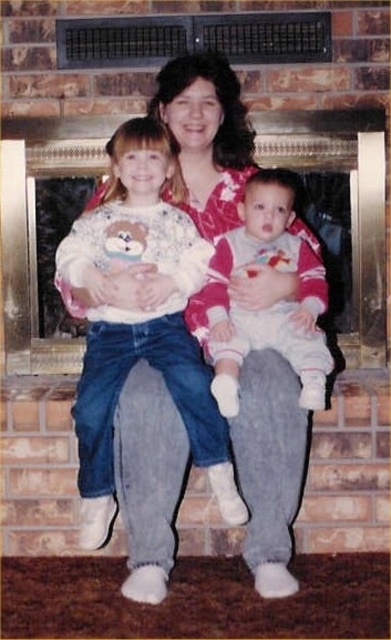
Does point (209, 417) lie behind point (240, 237)?

That is False.

At what (x,y) coordinates should I click in order to perform the action: click on white fleece sweater at center. Please return your answer as a coordinate pair (x, y). Looking at the image, I should click on (141, 326).